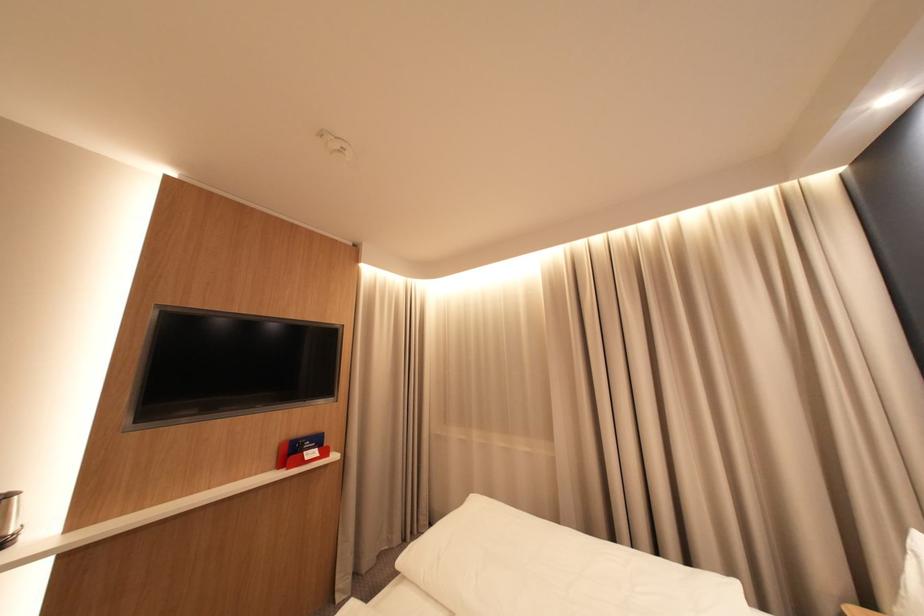
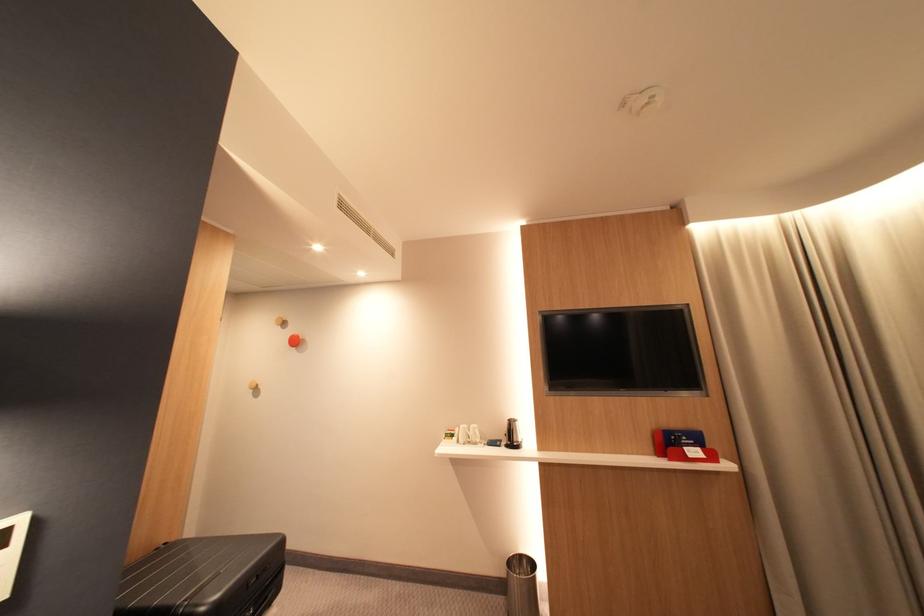
The point at (348, 460) is marked in the first image. Where is the corresponding point in the second image?

(747, 471)